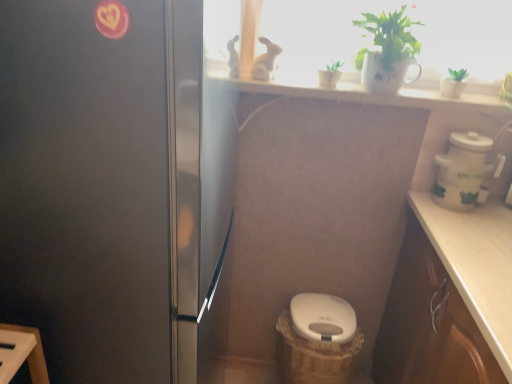
Where is `free space that is to the left of green matte plant at upper right, which is the third houseplant in left-to-right order`? This screenshot has width=512, height=384. free space that is to the left of green matte plant at upper right, which is the third houseplant in left-to-right order is located at coordinates (x=412, y=92).